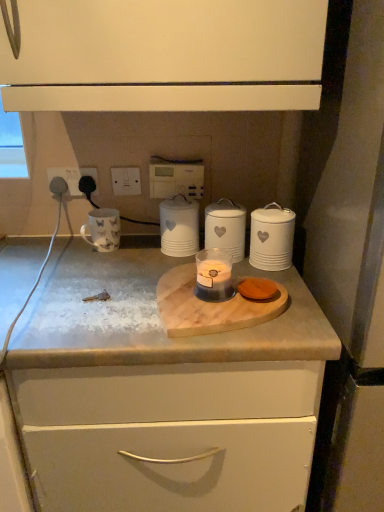
The height and width of the screenshot is (512, 384). What are the coordinates of `free location to the left of translucent glass candle at center` in the screenshot? It's located at (114, 300).